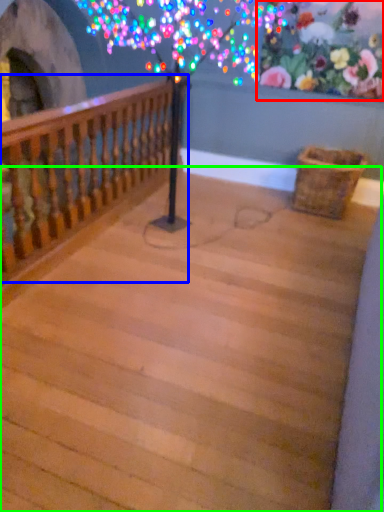
Question: Based on their relative distances, which object is nearer to floral arrangement (highlighted by a red box)? Choose from rail (highlighted by a blue box) and stairwell (highlighted by a green box).

Choices:
 (A) rail
 (B) stairwell

Answer: (A)